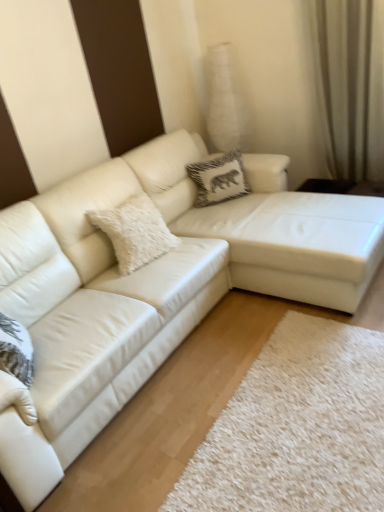
Question: Is beige fabric curtain at upper right closer to the viewer compared to white fluffy pillow at center, which ranks as the second pillow in back-to-front order?

Choices:
 (A) no
 (B) yes

Answer: (A)

Question: Is beige fabric curtain at upper right further to the viewer compared to white fluffy pillow at center, which is the 1th pillow from bottom to top?

Choices:
 (A) no
 (B) yes

Answer: (B)

Question: Considering the relative sizes of beige fabric curtain at upper right and white fluffy pillow at center, placed as the first pillow when sorted from left to right, in the image provided, is beige fabric curtain at upper right smaller than white fluffy pillow at center, placed as the first pillow when sorted from left to right,?

Choices:
 (A) yes
 (B) no

Answer: (B)

Question: Would you say beige fabric curtain at upper right is a long distance from white fluffy pillow at center, which appears as the 2th pillow when viewed from the right?

Choices:
 (A) yes
 (B) no

Answer: (A)

Question: Is beige fabric curtain at upper right wider than white fluffy pillow at center, placed as the first pillow when sorted from left to right?

Choices:
 (A) no
 (B) yes

Answer: (A)

Question: In the image, is white leather couch at center positioned in front of or behind beige fabric curtain at upper right?

Choices:
 (A) front
 (B) behind

Answer: (A)

Question: Based on their sizes in the image, would you say white leather couch at center is bigger or smaller than beige fabric curtain at upper right?

Choices:
 (A) big
 (B) small

Answer: (A)

Question: Considering the positions of white leather couch at center and beige fabric curtain at upper right in the image, is white leather couch at center wider or thinner than beige fabric curtain at upper right?

Choices:
 (A) wide
 (B) thin

Answer: (A)

Question: Is white leather couch at center situated inside beige fabric curtain at upper right or outside?

Choices:
 (A) outside
 (B) inside

Answer: (A)

Question: Does point (205, 195) appear closer or farther from the camera than point (152, 183)?

Choices:
 (A) closer
 (B) farther

Answer: (B)

Question: From the image's perspective, is white textured pillow at center, the 1th pillow in the right-to-left sequence, above or below white leather couch at center?

Choices:
 (A) above
 (B) below

Answer: (A)

Question: Considering their positions, is white textured pillow at center, the 2th pillow in the bottom-to-top sequence, located in front of or behind white leather couch at center?

Choices:
 (A) front
 (B) behind

Answer: (B)

Question: Is white textured pillow at center, the 2th pillow in the bottom-to-top sequence, spatially inside white leather couch at center, or outside of it?

Choices:
 (A) inside
 (B) outside

Answer: (A)

Question: Is white leather couch at center inside or outside of white fluffy pillow at center, which is the 1th pillow from front to back?

Choices:
 (A) outside
 (B) inside

Answer: (A)

Question: Considering the positions of point (215, 217) and point (130, 224), is point (215, 217) closer or farther from the camera than point (130, 224)?

Choices:
 (A) closer
 (B) farther

Answer: (B)